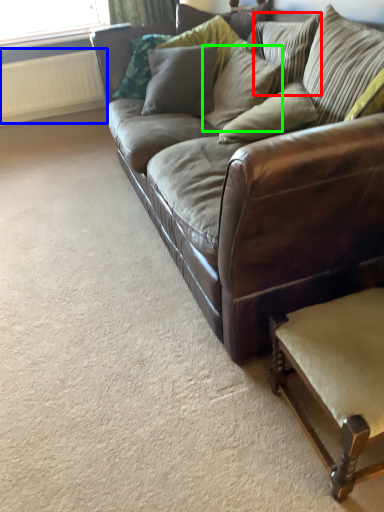
Question: Considering the real-world distances, which object is closest to pillow (highlighted by a red box)? radiator (highlighted by a blue box) or pillow (highlighted by a green box).

Choices:
 (A) radiator
 (B) pillow

Answer: (B)